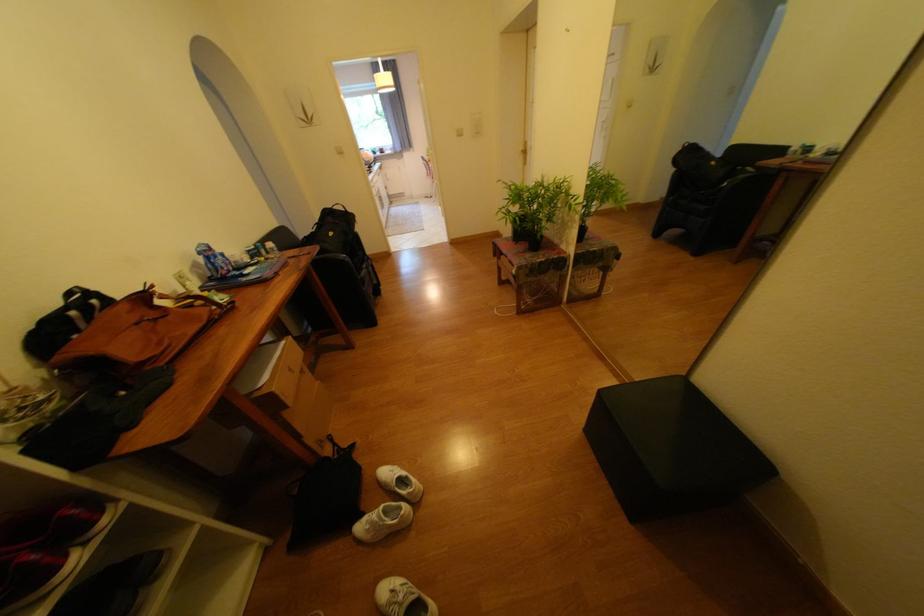
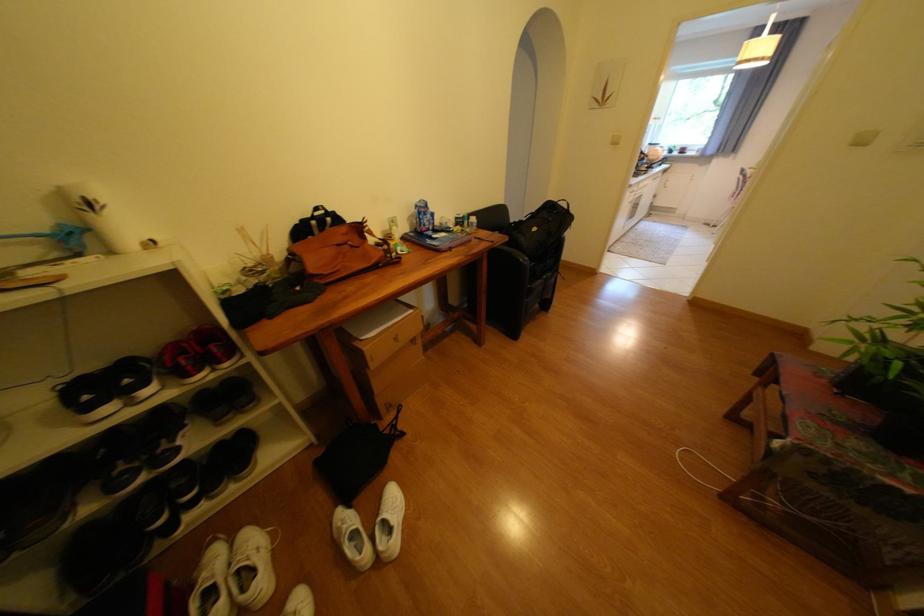
Find the pixel in the second image that matches (x=131, y=307) in the first image.

(351, 229)